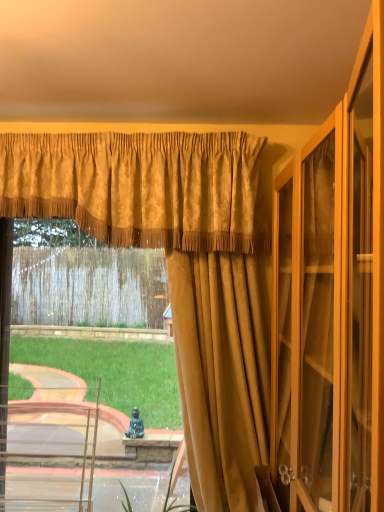
Question: Can you confirm if gold textured valance at upper center, which ranks as the 2th curtain in front-to-back order, is positioned to the right of gold textured curtain at center, arranged as the third curtain when viewed from the front?

Choices:
 (A) no
 (B) yes

Answer: (B)

Question: Can you confirm if gold textured valance at upper center, which is the 2th curtain in back-to-front order, is taller than gold textured curtain at center, arranged as the third curtain when viewed from the front?

Choices:
 (A) yes
 (B) no

Answer: (B)

Question: From the image's perspective, is gold textured valance at upper center, which ranks as the 2th curtain in front-to-back order, above gold textured curtain at center, positioned as the 1th curtain in back-to-front order?

Choices:
 (A) no
 (B) yes

Answer: (B)

Question: Is gold textured curtain at center, positioned as the 1th curtain in back-to-front order, located within gold textured valance at upper center, which is the 2th curtain in back-to-front order?

Choices:
 (A) no
 (B) yes

Answer: (A)

Question: Is gold textured valance at upper center, which ranks as the 2th curtain in front-to-back order, next to gold textured curtain at center, positioned as the 1th curtain in back-to-front order?

Choices:
 (A) yes
 (B) no

Answer: (B)

Question: Visually, is suede-like gold curtain at center, which appears as the third curtain when viewed from the back, positioned to the left or to the right of gold textured valance at upper center, which ranks as the 2th curtain in front-to-back order?

Choices:
 (A) right
 (B) left

Answer: (A)

Question: Considering the positions of suede-like gold curtain at center, which appears as the third curtain when viewed from the back, and gold textured valance at upper center, which is the 2th curtain in back-to-front order, in the image, is suede-like gold curtain at center, which appears as the third curtain when viewed from the back, bigger or smaller than gold textured valance at upper center, which is the 2th curtain in back-to-front order,?

Choices:
 (A) small
 (B) big

Answer: (A)

Question: In the image, is suede-like gold curtain at center, which appears as the third curtain when viewed from the back, positioned in front of or behind gold textured valance at upper center, which is the 2th curtain in back-to-front order?

Choices:
 (A) behind
 (B) front

Answer: (B)

Question: Considering the positions of suede-like gold curtain at center, which appears as the third curtain when viewed from the back, and gold textured valance at upper center, which is the 2th curtain in back-to-front order, in the image, is suede-like gold curtain at center, which appears as the third curtain when viewed from the back, taller or shorter than gold textured valance at upper center, which is the 2th curtain in back-to-front order,?

Choices:
 (A) tall
 (B) short

Answer: (A)

Question: Would you say gold textured curtain at center, arranged as the third curtain when viewed from the front, is to the left or to the right of gold textured valance at upper center, which ranks as the 2th curtain in front-to-back order, in the picture?

Choices:
 (A) right
 (B) left

Answer: (B)

Question: Which is correct: gold textured curtain at center, positioned as the 1th curtain in back-to-front order, is inside gold textured valance at upper center, which ranks as the 2th curtain in front-to-back order, or outside of it?

Choices:
 (A) inside
 (B) outside

Answer: (B)

Question: In terms of size, does gold textured curtain at center, positioned as the 1th curtain in back-to-front order, appear bigger or smaller than gold textured valance at upper center, which is the 2th curtain in back-to-front order?

Choices:
 (A) big
 (B) small

Answer: (A)

Question: Is point (235, 338) positioned closer to the camera than point (223, 224)?

Choices:
 (A) closer
 (B) farther

Answer: (B)

Question: Considering the positions of suede-like gold curtain at center, the first curtain viewed from the front, and gold textured curtain at center, positioned as the 1th curtain in back-to-front order, in the image, is suede-like gold curtain at center, the first curtain viewed from the front, taller or shorter than gold textured curtain at center, positioned as the 1th curtain in back-to-front order,?

Choices:
 (A) tall
 (B) short

Answer: (A)

Question: Considering the positions of point (182, 401) and point (195, 165), is point (182, 401) closer or farther from the camera than point (195, 165)?

Choices:
 (A) farther
 (B) closer

Answer: (B)